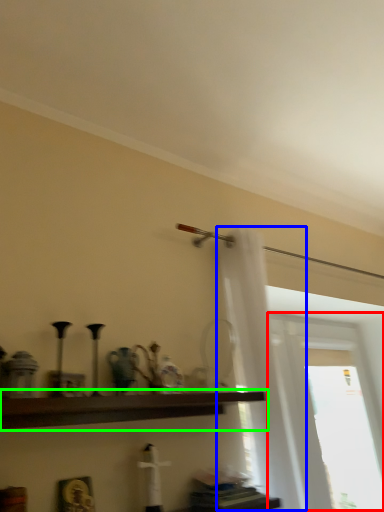
Question: Considering the real-world distances, which object is farthest from window (highlighted by a red box)? shower curtain (highlighted by a blue box) or shelf (highlighted by a green box)?

Choices:
 (A) shower curtain
 (B) shelf

Answer: (B)